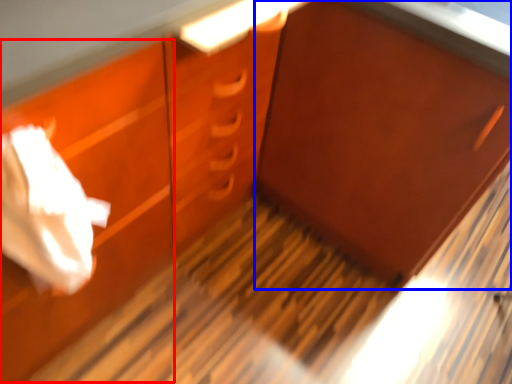
Question: Which object appears farthest to the camera in this image, drawer (highlighted by a red box) or cabinetry (highlighted by a blue box)?

Choices:
 (A) drawer
 (B) cabinetry

Answer: (B)